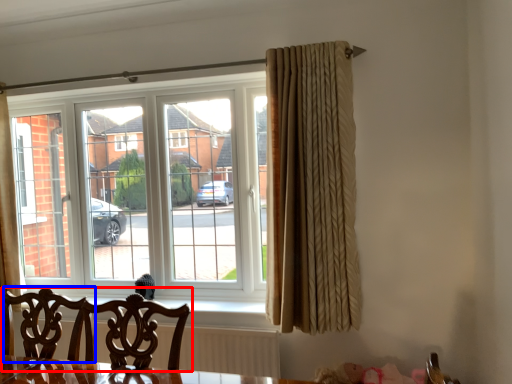
Question: Among these objects, which one is farthest to the camera, chair (highlighted by a red box) or swivel chair (highlighted by a blue box)?

Choices:
 (A) chair
 (B) swivel chair

Answer: (B)